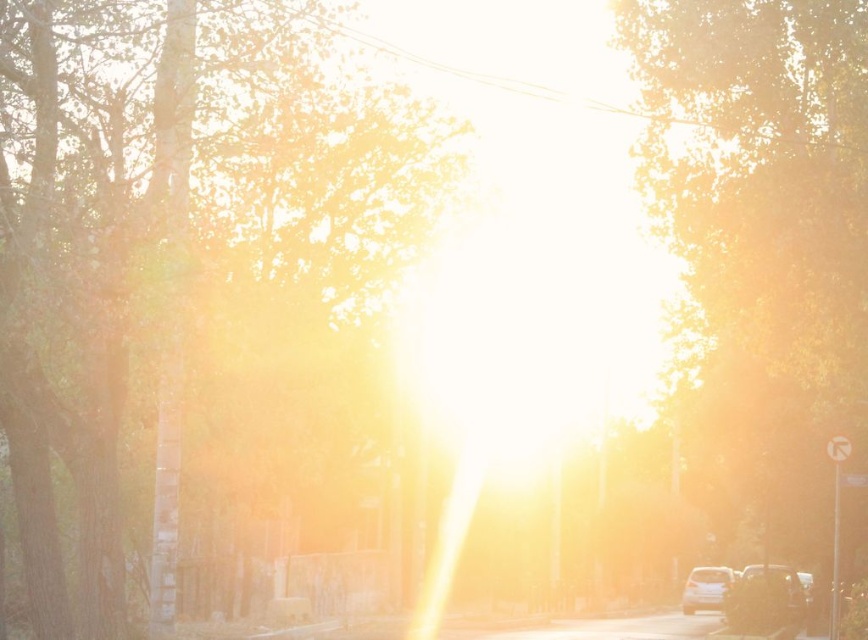
Does smooth golden tree at right have a smaller size compared to satin white car at lower right?

No, smooth golden tree at right is not smaller than satin white car at lower right.

Does smooth golden tree at right have a lesser height compared to satin white car at lower right?

In fact, smooth golden tree at right may be taller than satin white car at lower right.

Between point (727, 134) and point (728, 577), which one is positioned behind?

The point (728, 577) is behind.

The height and width of the screenshot is (640, 868). In order to click on smooth golden tree at right in this screenshot , I will do `click(760, 243)`.

Does smooth brown tree trunk at center have a greater width compared to smokey black car at lower right?

Yes.

Which is more to the left, smooth brown tree trunk at center or smokey black car at lower right?

smooth brown tree trunk at center

Which is behind, point (125, 344) or point (757, 576)?

The point (757, 576) is behind.

Identify the location of smooth brown tree trunk at center. pyautogui.click(x=199, y=284).

Between smooth golden tree at right and smokey black car at lower right, which one is positioned higher?

Positioned higher is smooth golden tree at right.

Which is in front, point (724, 61) or point (787, 595)?

Point (724, 61) is more forward.

Find the location of a particular element. This screenshot has width=868, height=640. smooth golden tree at right is located at coordinates (760, 243).